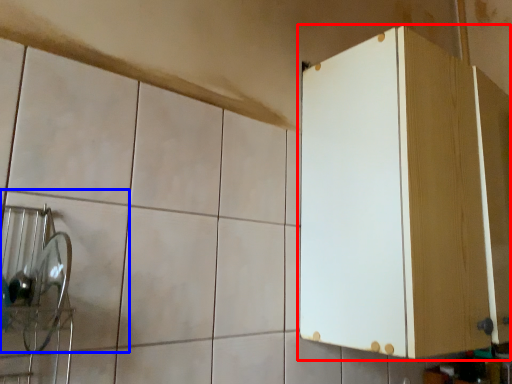
Question: Which of the following is the farthest to the observer, cabinetry (highlighted by a red box) or ceramic tile (highlighted by a blue box)?

Choices:
 (A) cabinetry
 (B) ceramic tile

Answer: (A)